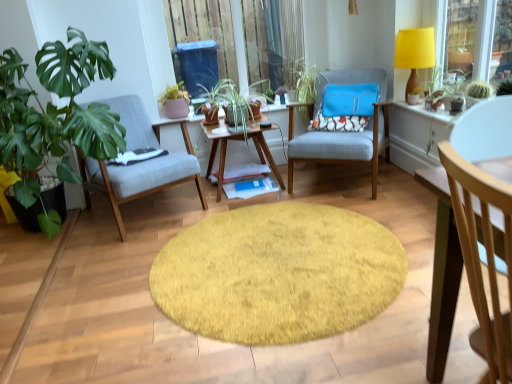
Question: From a real-world perspective, is woodenobject at center positioned above or below matte pink pot at center, the 1th houseplant in the right-to-left sequence?

Choices:
 (A) above
 (B) below

Answer: (B)

Question: Considering the positions of woodenobject at center and matte pink pot at center, the 1th houseplant in the right-to-left sequence, in the image, is woodenobject at center wider or thinner than matte pink pot at center, the 1th houseplant in the right-to-left sequence,?

Choices:
 (A) wide
 (B) thin

Answer: (A)

Question: Considering the real-world distances, which object is farthest from the woodenwoodencoffee table at center?

Choices:
 (A) green leafy plant at center
 (B) floral fabric pillow at center
 (C) light wood chair at right, arranged as the first chair when viewed from the front
 (D) transparent plastic window screen at upper center
 (E) woodenobject at center

Answer: (C)

Question: Which is farther from the yellow fabric lampshade at upper right?

Choices:
 (A) light wood chair at right, placed as the third chair when sorted from left to right
 (B) woodenobject at center
 (C) textured fabric armchair at center, the 3th chair from the front
 (D) matte gray chair at left, acting as the 2th chair starting from the back
 (E) woodenwoodencoffee table at center

Answer: (A)